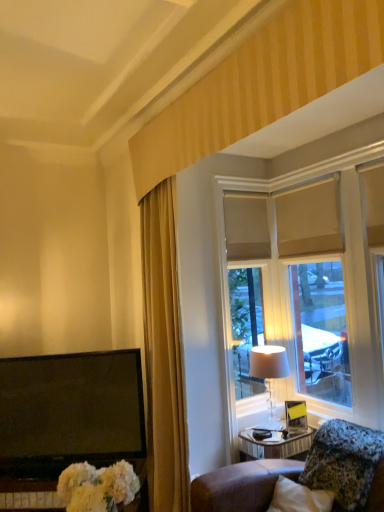
This screenshot has width=384, height=512. Identify the location of gold fabric curtain at left. pyautogui.click(x=164, y=353).

Measure the distance between granite-like stone pillow at lower right and camera.

They are 6.80 feet apart.

What do you see at coordinates (303, 473) in the screenshot? The image size is (384, 512). I see `granite-like stone pillow at lower right` at bounding box center [303, 473].

The width and height of the screenshot is (384, 512). What do you see at coordinates (97, 487) in the screenshot? I see `white fluffy bouquet at lower left` at bounding box center [97, 487].

Locate an element on the screen. beige fabric window at upper right is located at coordinates (345, 290).

You are a GUI agent. You are given a task and a screenshot of the screen. Output one action in this format:
    pyautogui.click(x=<x>, y=<y>)
    Task: Click on the gold fabric curtain at left
    Image resolution: width=384 pixels, height=512 pixels.
    Given the screenshot: What is the action you would take?
    pyautogui.click(x=164, y=353)

Considering the positions of points (349, 451) and (86, 509), is point (349, 451) farther from camera compared to point (86, 509)?

Yes, point (349, 451) is farther from viewer.

Does granite-like stone pillow at lower right appear on the left side of white fluffy bouquet at lower left?

Incorrect, granite-like stone pillow at lower right is not on the left side of white fluffy bouquet at lower left.

From a real-world perspective, between granite-like stone pillow at lower right and white fluffy bouquet at lower left, who is vertically lower?

In real-world perspective, granite-like stone pillow at lower right is lower.

Who is taller, gold fabric curtain at left or beige fabric window at upper right?

gold fabric curtain at left.

From the image's perspective, between gold fabric curtain at left and beige fabric window at upper right, who is located below?

From the image's view, gold fabric curtain at left is below.

In the scene shown: From a real-world perspective, which object rests below the other?

gold fabric curtain at left.

How distant is gold fabric curtain at left from beige fabric window at upper right?

A distance of 31.78 inches exists between gold fabric curtain at left and beige fabric window at upper right.

Is matte beige lampshade at right in front of white fluffy bouquet at lower left?

No, it is not.

What's the angular difference between matte beige lampshade at right and white fluffy bouquet at lower left's facing directions?

matte beige lampshade at right and white fluffy bouquet at lower left are facing 1.8 degrees away from each other.

From a real-world perspective, which object stands above the other?

In real-world perspective, matte beige lampshade at right is above.

Which is behind, granite-like stone pillow at lower right or gold fabric curtain at left?

gold fabric curtain at left is more distant.

Consider the image. From the image's perspective, is granite-like stone pillow at lower right located beneath gold fabric curtain at left?

Yes.

Between granite-like stone pillow at lower right and gold fabric curtain at left, which one has more height?

gold fabric curtain at left is taller.

Is granite-like stone pillow at lower right located outside gold fabric curtain at left?

granite-like stone pillow at lower right is positioned outside gold fabric curtain at left.

From a real-world perspective, who is located lower, gold fabric curtain at left or white fluffy bouquet at lower left?

From a 3D spatial view, white fluffy bouquet at lower left is below.

Measure the distance between gold fabric curtain at left and white fluffy bouquet at lower left.

gold fabric curtain at left is 35.64 inches away from white fluffy bouquet at lower left.

Does gold fabric curtain at left lie in front of white fluffy bouquet at lower left?

No, gold fabric curtain at left is further to the viewer.

Is point (147, 262) less distant than point (115, 489)?

No, it is not.

Is beige fabric window at upper right bigger or smaller than matte beige lampshade at right?

Considering their sizes, beige fabric window at upper right takes up more space than matte beige lampshade at right.

From a real-world perspective, is beige fabric window at upper right above or below matte beige lampshade at right?

beige fabric window at upper right is above matte beige lampshade at right.

Could you tell me if beige fabric window at upper right is turned towards matte beige lampshade at right?

Yes, beige fabric window at upper right is aimed at matte beige lampshade at right.

From the picture: Which is correct: beige fabric window at upper right is inside matte beige lampshade at right, or outside of it?

beige fabric window at upper right lies outside matte beige lampshade at right.

From a real-world perspective, is beige fabric window at upper right positioned above or below white fluffy bouquet at lower left?

beige fabric window at upper right is above white fluffy bouquet at lower left.

Between beige fabric window at upper right and white fluffy bouquet at lower left, which one appears on the left side from the viewer's perspective?

white fluffy bouquet at lower left.

From the image's perspective, is beige fabric window at upper right over white fluffy bouquet at lower left?

Yes, from the image's perspective, beige fabric window at upper right is on top of white fluffy bouquet at lower left.

How different are the orientations of beige fabric window at upper right and white fluffy bouquet at lower left in degrees?

1.96 degrees separate the facing orientations of beige fabric window at upper right and white fluffy bouquet at lower left.

Where is `furniture that appears below the white fluffy bouquet at lower left (from the image's perspective)`? The image size is (384, 512). furniture that appears below the white fluffy bouquet at lower left (from the image's perspective) is located at coordinates (303, 473).

Where is `curtain on the left of beige fabric window at upper right`? curtain on the left of beige fabric window at upper right is located at coordinates tap(164, 353).

Which object lies nearer to the anchor point beige fabric window at upper right, matte beige lampshade at right or granite-like stone pillow at lower right?

Based on the image, matte beige lampshade at right appears to be nearer to beige fabric window at upper right.

From the image, which object appears to be farther from white fluffy bouquet at lower left, beige fabric window at upper right or granite-like stone pillow at lower right?

beige fabric window at upper right is positioned further to the anchor white fluffy bouquet at lower left.

Looking at the image, which one is located closer to granite-like stone pillow at lower right, white fluffy bouquet at lower left or matte beige lampshade at right?

matte beige lampshade at right lies closer to granite-like stone pillow at lower right than the other object.

Which object lies nearer to the anchor point gold fabric curtain at left, granite-like stone pillow at lower right or matte beige lampshade at right?

Based on the image, granite-like stone pillow at lower right appears to be nearer to gold fabric curtain at left.

From the image, which object appears to be nearer to white fluffy bouquet at lower left, granite-like stone pillow at lower right or beige fabric window at upper right?

Based on the image, granite-like stone pillow at lower right appears to be nearer to white fluffy bouquet at lower left.

Based on their spatial positions, is beige fabric window at upper right or gold fabric curtain at left closer to white fluffy bouquet at lower left?

gold fabric curtain at left is closer to white fluffy bouquet at lower left.

Based on their spatial positions, is granite-like stone pillow at lower right or beige fabric window at upper right further from gold fabric curtain at left?

beige fabric window at upper right is further to gold fabric curtain at left.

Which object lies nearer to the anchor point white fluffy bouquet at lower left, granite-like stone pillow at lower right or matte beige lampshade at right?

granite-like stone pillow at lower right is closer to white fluffy bouquet at lower left.

This screenshot has height=512, width=384. In order to click on furniture situated between white fluffy bouquet at lower left and beige fabric window at upper right from left to right in this screenshot , I will do `click(303, 473)`.

Locate an element on the screen. The height and width of the screenshot is (512, 384). table lamp between beige fabric window at upper right and granite-like stone pillow at lower right vertically is located at coordinates (269, 365).

Find the location of a particular element. This screenshot has height=512, width=384. curtain positioned between white fluffy bouquet at lower left and matte beige lampshade at right from near to far is located at coordinates (164, 353).

Locate an element on the screen. The width and height of the screenshot is (384, 512). curtain located between white fluffy bouquet at lower left and granite-like stone pillow at lower right in the left-right direction is located at coordinates (164, 353).